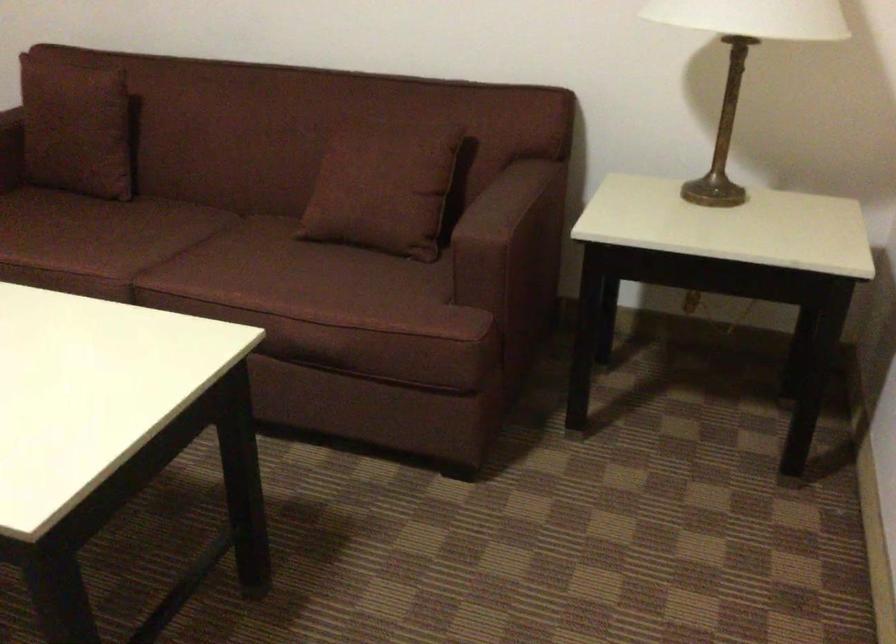
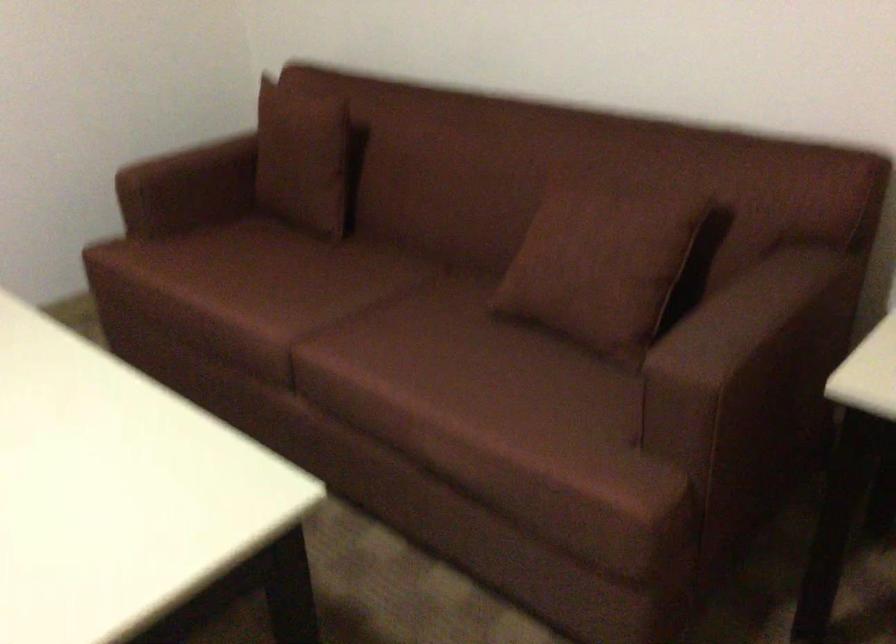
Question: The camera is either moving clockwise (left) or counter-clockwise (right) around the object. The first image is from the beginning of the video and the second image is from the end. Is the camera moving left or right when shooting the video?

Choices:
 (A) Left
 (B) Right

Answer: (B)